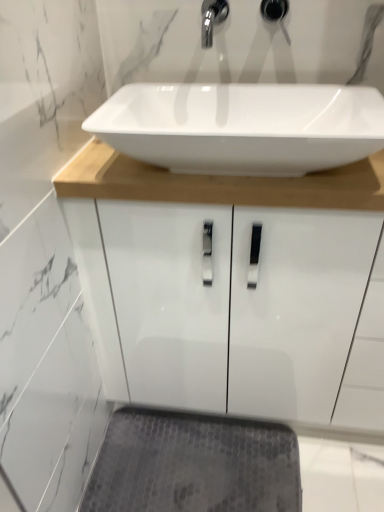
Question: Does gray textured bath mat at lower center appear on the right side of matte black faucet at upper center?

Choices:
 (A) yes
 (B) no

Answer: (B)

Question: Is gray textured bath mat at lower center turned away from matte black faucet at upper center?

Choices:
 (A) yes
 (B) no

Answer: (B)

Question: Is the depth of gray textured bath mat at lower center less than that of matte black faucet at upper center?

Choices:
 (A) no
 (B) yes

Answer: (A)

Question: Does gray textured bath mat at lower center have a greater height compared to matte black faucet at upper center?

Choices:
 (A) yes
 (B) no

Answer: (B)

Question: Can you confirm if gray textured bath mat at lower center is bigger than matte black faucet at upper center?

Choices:
 (A) yes
 (B) no

Answer: (A)

Question: Is point (278, 456) closer or farther from the camera than point (279, 14)?

Choices:
 (A) closer
 (B) farther

Answer: (B)

Question: From the image's perspective, is gray textured bath mat at lower center above or below matte black faucet at upper center?

Choices:
 (A) above
 (B) below

Answer: (B)

Question: Is gray textured bath mat at lower center in front of or behind matte black faucet at upper center in the image?

Choices:
 (A) front
 (B) behind

Answer: (B)

Question: Is gray textured bath mat at lower center inside the boundaries of matte black faucet at upper center, or outside?

Choices:
 (A) outside
 (B) inside

Answer: (A)

Question: From a real-world perspective, is gray textured bath mat at lower center positioned above or below white glossy sink at center?

Choices:
 (A) above
 (B) below

Answer: (B)

Question: Considering the positions of gray textured bath mat at lower center and white glossy sink at center in the image, is gray textured bath mat at lower center taller or shorter than white glossy sink at center?

Choices:
 (A) tall
 (B) short

Answer: (B)

Question: Considering the positions of gray textured bath mat at lower center and white glossy sink at center in the image, is gray textured bath mat at lower center wider or thinner than white glossy sink at center?

Choices:
 (A) wide
 (B) thin

Answer: (B)

Question: Is point (144, 493) closer or farther from the camera than point (289, 94)?

Choices:
 (A) closer
 (B) farther

Answer: (B)

Question: From the image's perspective, is white glossy sink at center positioned above or below gray textured bath mat at lower center?

Choices:
 (A) below
 (B) above

Answer: (B)

Question: Is white glossy sink at center wider or thinner than gray textured bath mat at lower center?

Choices:
 (A) wide
 (B) thin

Answer: (A)